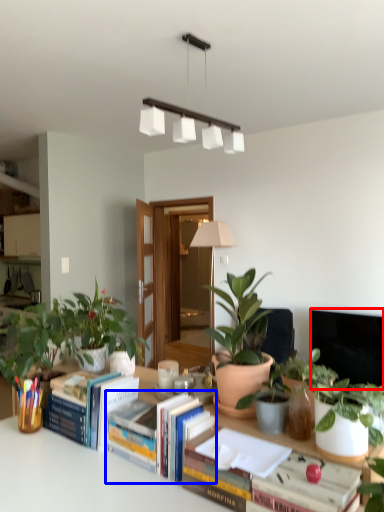
Question: Which of the following is the farthest to the observer, television (highlighted by a red box) or book (highlighted by a blue box)?

Choices:
 (A) television
 (B) book

Answer: (A)